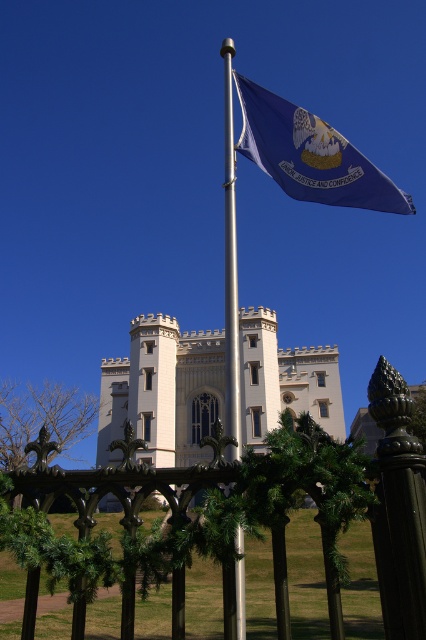
You are a drone operator planning to film the white stone palace at center and the blue fabric flag at upper center. The minimum distance between the two objects for a smooth camera transition is 75 meters. Can you safely perform the transition?

The white stone palace at center and blue fabric flag at upper center are 80.07 meters apart, which exceeds the minimum required distance of 75 meters. Therefore, the transition can be safely performed.

You are a visitor standing in front of the white stone palace at center and the silver metallic flag pole at center. Which object is closer to you?

The white stone palace at center is closer to you since the silver metallic flag pole at center is positioned behind it.

You are standing in front of the historic building and want to take a photo that includes both the point at location (310, 356) and the point at (233, 634). Based on their positions, which point is closer to the camera?

Point (233, 634) is closer to the camera since it is positioned behind point (310, 356), which is further away.